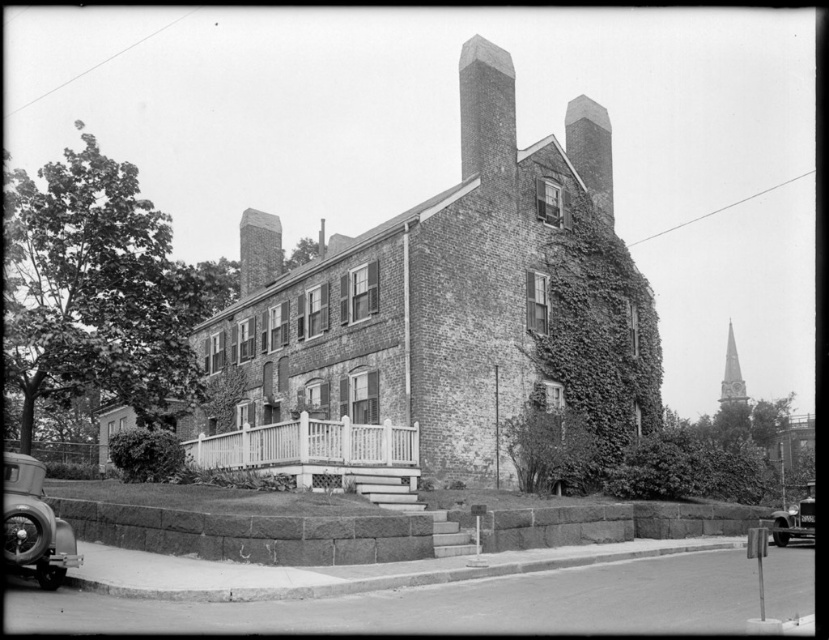
You are standing in front of the historic brick building and want to take a photo of both the green ivy at lower left and the shiny black car at lower right. Which object should you focus on first to ensure both are in the frame?

You should focus on the green ivy at lower left first because it is closer to you than the shiny black car at lower right, so adjusting the camera to include both would require ensuring the closer object is framed properly first.

You are standing in front of the historic brick building and want to know which of the two points, point [643,433] or point [490,97], is closer to you. Can you determine this based on their positions?

Point [643,433] is closer to you because it is further to the viewer than point [490,97].